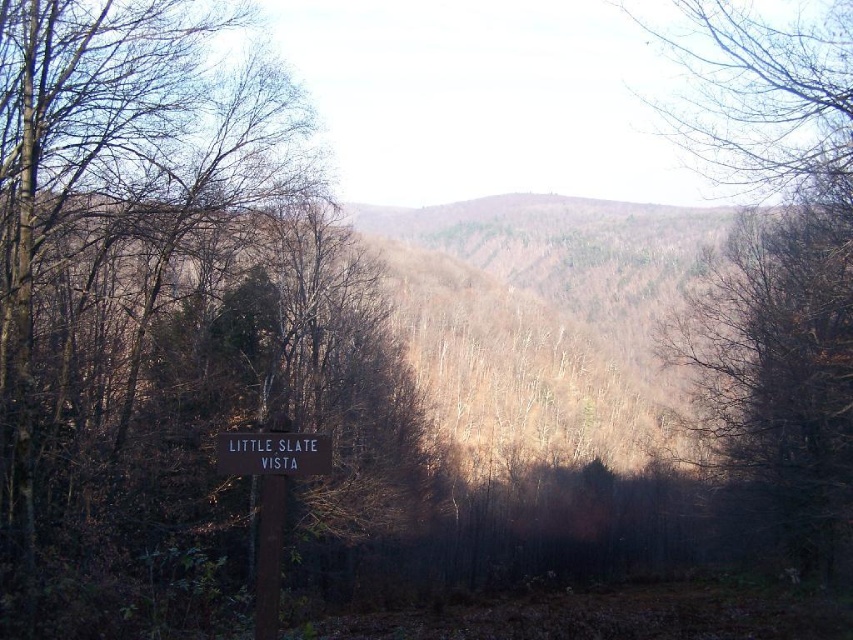
Is brown wooden sign at lower center bigger than black wood sign at center?

Yes, brown wooden sign at lower center is bigger than black wood sign at center.

In the scene shown: Which is above, brown wooden sign at lower center or black wood sign at center?

black wood sign at center is above.

Who is more forward, (270,570) or (323,435)?

Point (270,570) is in front.

I want to click on brown wooden sign at lower center, so click(x=270, y=500).

Is brown matte tree at right shorter than brown wooden sign at lower center?

Incorrect, brown matte tree at right's height does not fall short of brown wooden sign at lower center's.

Who is higher up, brown matte tree at right or brown wooden sign at lower center?

brown matte tree at right is higher up.

The width and height of the screenshot is (853, 640). What do you see at coordinates (779, 272) in the screenshot?
I see `brown matte tree at right` at bounding box center [779, 272].

At what (x,y) coordinates should I click in order to perform the action: click on brown matte tree at right. Please return your answer as a coordinate pair (x, y). The image size is (853, 640). Looking at the image, I should click on (779, 272).

Which is in front, point (808, 209) or point (225, 440)?

Point (225, 440)

Between brown matte tree at right and black wood sign at center, which one is positioned lower?

black wood sign at center

This screenshot has width=853, height=640. What do you see at coordinates (779, 272) in the screenshot?
I see `brown matte tree at right` at bounding box center [779, 272].

Where is `brown matte tree at right`? Image resolution: width=853 pixels, height=640 pixels. brown matte tree at right is located at coordinates (779, 272).